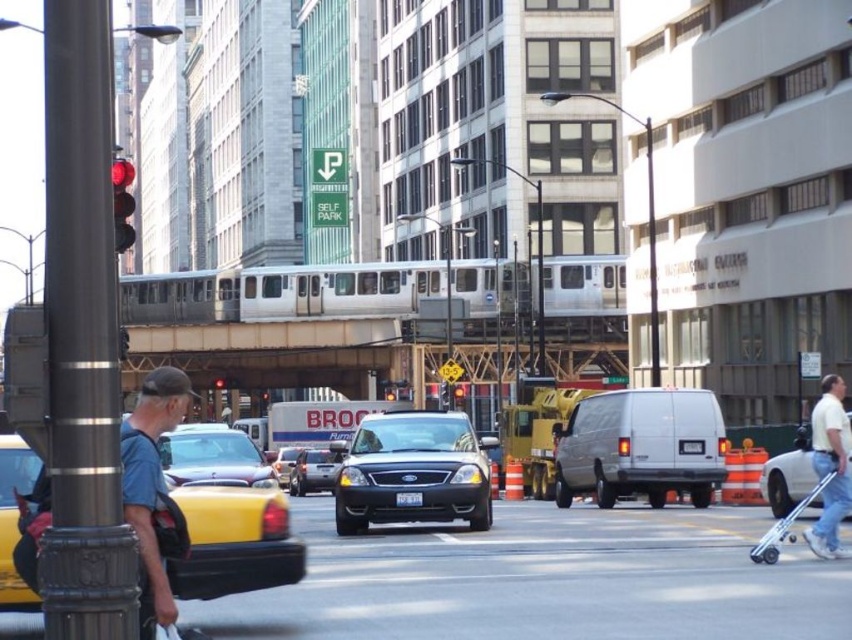
Question: Can you confirm if red glass traffic light at left is positioned below red glass traffic light at upper left?

Choices:
 (A) no
 (B) yes

Answer: (A)

Question: Does matte black sedan at center have a larger size compared to metallic silver sedan at center?

Choices:
 (A) no
 (B) yes

Answer: (B)

Question: Which object is closer to the camera taking this photo?

Choices:
 (A) shiny metallic sedan at center
 (B) red glass traffic light at left

Answer: (B)

Question: Among these points, which one is farthest from the camera?

Choices:
 (A) [x=335, y=492]
 (B) [x=309, y=465]
 (C) [x=101, y=52]
 (D) [x=213, y=474]

Answer: (B)

Question: Is yellow rubber taxi at lower left below red glass traffic light at upper left?

Choices:
 (A) no
 (B) yes

Answer: (A)

Question: Which object is closer to the camera taking this photo?

Choices:
 (A) white matte van at center
 (B) matte black sedan at center
 (C) white cotton shirt at right

Answer: (C)